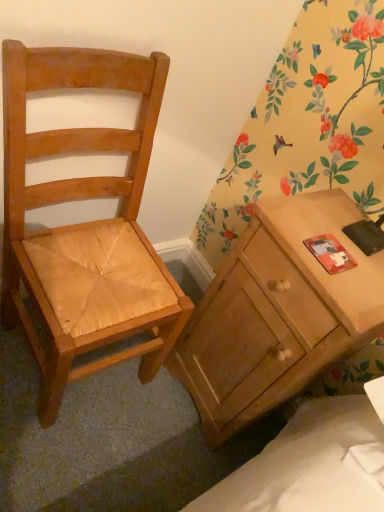
Question: Is light brown wood chair at left taller than matte wood desk at right?

Choices:
 (A) no
 (B) yes

Answer: (B)

Question: From a real-world perspective, is light brown wood chair at left physically above matte wood desk at right?

Choices:
 (A) no
 (B) yes

Answer: (B)

Question: Can you confirm if light brown wood chair at left is positioned to the left of matte wood desk at right?

Choices:
 (A) no
 (B) yes

Answer: (B)

Question: From the image's perspective, does light brown wood chair at left appear lower than matte wood desk at right?

Choices:
 (A) yes
 (B) no

Answer: (B)

Question: Does light brown wood chair at left have a larger size compared to matte wood desk at right?

Choices:
 (A) no
 (B) yes

Answer: (B)

Question: Can you confirm if light brown wood chair at left is thinner than matte wood desk at right?

Choices:
 (A) no
 (B) yes

Answer: (A)

Question: Does matte wood desk at right have a smaller size compared to light brown wood chair at left?

Choices:
 (A) no
 (B) yes

Answer: (B)

Question: Does matte wood desk at right lie in front of light brown wood chair at left?

Choices:
 (A) no
 (B) yes

Answer: (A)

Question: From the image's perspective, is matte wood desk at right below light brown wood chair at left?

Choices:
 (A) no
 (B) yes

Answer: (B)

Question: From a real-world perspective, is matte wood desk at right located higher than light brown wood chair at left?

Choices:
 (A) yes
 (B) no

Answer: (B)

Question: Is matte wood desk at right to the right of light brown wood chair at left from the viewer's perspective?

Choices:
 (A) no
 (B) yes

Answer: (B)

Question: Is matte wood desk at right further to the viewer compared to light brown wood chair at left?

Choices:
 (A) yes
 (B) no

Answer: (A)

Question: Is light brown wood chair at left in front of or behind matte wood desk at right in the image?

Choices:
 (A) front
 (B) behind

Answer: (A)